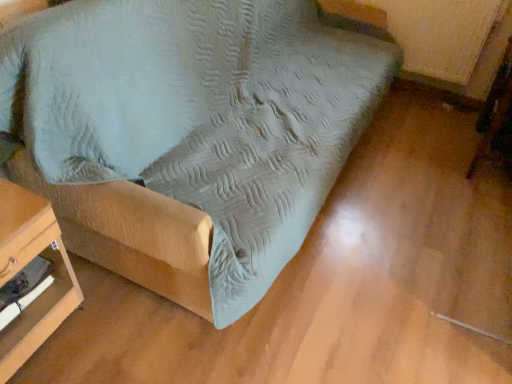
Describe the element at coordinates (496, 120) in the screenshot. I see `wooden swivel chair at lower right` at that location.

Find the location of a particular element. wooden table at lower left, which ranks as the first furniture in left-to-right order is located at coordinates (24, 266).

Locate an element on the screen. Image resolution: width=512 pixels, height=384 pixels. suede-like fabric couch at center, the 2th furniture when ordered from left to right is located at coordinates (200, 114).

Considering the points (4, 378) and (46, 45), which point is behind, point (4, 378) or point (46, 45)?

Positioned behind is point (4, 378).

Is wooden table at lower left, the 2th furniture when ordered from right to left, bigger or smaller than suede-like fabric couch at center, the 2th furniture when ordered from left to right?

In the image, wooden table at lower left, the 2th furniture when ordered from right to left, appears to be smaller than suede-like fabric couch at center, the 2th furniture when ordered from left to right.

From the image's perspective, is wooden table at lower left, which ranks as the first furniture in left-to-right order, below suede-like fabric couch at center, the 2th furniture when ordered from left to right?

Yes.

From a real-world perspective, is wooden table at lower left, which ranks as the first furniture in left-to-right order, physically located above or below suede-like fabric couch at center, the 2th furniture when ordered from left to right?

From a real-world perspective, wooden table at lower left, which ranks as the first furniture in left-to-right order, is physically below suede-like fabric couch at center, the 2th furniture when ordered from left to right.

Is wooden table at lower left, which ranks as the first furniture in left-to-right order, taller or shorter than wooden swivel chair at lower right?

wooden table at lower left, which ranks as the first furniture in left-to-right order, is shorter than wooden swivel chair at lower right.

Between wooden table at lower left, the 2th furniture when ordered from right to left, and wooden swivel chair at lower right, which one has larger size?

Bigger between the two is wooden swivel chair at lower right.

Is wooden swivel chair at lower right a part of wooden table at lower left, the 2th furniture when ordered from right to left?

No, wooden swivel chair at lower right is not a part of wooden table at lower left, the 2th furniture when ordered from right to left.

Between suede-like fabric couch at center, the 2th furniture when ordered from left to right, and wooden swivel chair at lower right, which one has more height?

Standing taller between the two is suede-like fabric couch at center, the 2th furniture when ordered from left to right.

Which object is closer to the camera, suede-like fabric couch at center, placed as the 1th furniture when sorted from right to left, or wooden swivel chair at lower right?

suede-like fabric couch at center, placed as the 1th furniture when sorted from right to left, is closer to the camera.

Looking at this image, are suede-like fabric couch at center, placed as the 1th furniture when sorted from right to left, and wooden swivel chair at lower right beside each other?

No, suede-like fabric couch at center, placed as the 1th furniture when sorted from right to left, is not beside wooden swivel chair at lower right.

Considering the sizes of objects suede-like fabric couch at center, the 2th furniture when ordered from left to right, and wooden swivel chair at lower right in the image provided, who is wider, suede-like fabric couch at center, the 2th furniture when ordered from left to right, or wooden swivel chair at lower right?

suede-like fabric couch at center, the 2th furniture when ordered from left to right.

From a real-world perspective, between suede-like fabric couch at center, placed as the 1th furniture when sorted from right to left, and wooden table at lower left, which ranks as the first furniture in left-to-right order, who is vertically higher?

In real-world perspective, suede-like fabric couch at center, placed as the 1th furniture when sorted from right to left, is above.

Based on the photo, is suede-like fabric couch at center, placed as the 1th furniture when sorted from right to left, positioned beyond the bounds of wooden table at lower left, which ranks as the first furniture in left-to-right order?

suede-like fabric couch at center, placed as the 1th furniture when sorted from right to left, is positioned outside wooden table at lower left, which ranks as the first furniture in left-to-right order.

Which is farther from the camera, (217, 7) or (41, 199)?

The point (217, 7) is behind.

Is suede-like fabric couch at center, placed as the 1th furniture when sorted from right to left, wider or thinner than wooden table at lower left, the 2th furniture when ordered from right to left?

In the image, suede-like fabric couch at center, placed as the 1th furniture when sorted from right to left, appears to be wider than wooden table at lower left, the 2th furniture when ordered from right to left.

Is wooden swivel chair at lower right with wooden table at lower left, which ranks as the first furniture in left-to-right order?

They are not placed beside each other.

Which of these two, wooden swivel chair at lower right or wooden table at lower left, the 2th furniture when ordered from right to left, is wider?

With larger width is wooden table at lower left, the 2th furniture when ordered from right to left.

Based on their sizes in the image, would you say wooden swivel chair at lower right is bigger or smaller than wooden table at lower left, which ranks as the first furniture in left-to-right order?

wooden swivel chair at lower right is bigger than wooden table at lower left, which ranks as the first furniture in left-to-right order.

Is wooden swivel chair at lower right far from suede-like fabric couch at center, the 2th furniture when ordered from left to right?

Yes.

Between wooden swivel chair at lower right and suede-like fabric couch at center, the 2th furniture when ordered from left to right, which one has less height?

With less height is wooden swivel chair at lower right.

From the image's perspective, which object appears higher, wooden swivel chair at lower right or suede-like fabric couch at center, the 2th furniture when ordered from left to right?

suede-like fabric couch at center, the 2th furniture when ordered from left to right, appears higher in the image.

Which is in front, wooden swivel chair at lower right or suede-like fabric couch at center, placed as the 1th furniture when sorted from right to left?

suede-like fabric couch at center, placed as the 1th furniture when sorted from right to left, is more forward.

Locate an element on the screen. The height and width of the screenshot is (384, 512). furniture located below the suede-like fabric couch at center, placed as the 1th furniture when sorted from right to left (from the image's perspective) is located at coordinates (24, 266).

Identify the location of swivel chair behind the wooden table at lower left, which ranks as the first furniture in left-to-right order. (496, 120).

Based on the photo, looking at the image, which one is located closer to suede-like fabric couch at center, placed as the 1th furniture when sorted from right to left, wooden table at lower left, the 2th furniture when ordered from right to left, or wooden swivel chair at lower right?

wooden table at lower left, the 2th furniture when ordered from right to left.

Looking at the image, which one is located closer to wooden table at lower left, the 2th furniture when ordered from right to left, wooden swivel chair at lower right or suede-like fabric couch at center, placed as the 1th furniture when sorted from right to left?

suede-like fabric couch at center, placed as the 1th furniture when sorted from right to left, is positioned closer to the anchor wooden table at lower left, the 2th furniture when ordered from right to left.

From the image, which object appears to be nearer to wooden swivel chair at lower right, suede-like fabric couch at center, the 2th furniture when ordered from left to right, or wooden table at lower left, the 2th furniture when ordered from right to left?

Among the two, suede-like fabric couch at center, the 2th furniture when ordered from left to right, is located nearer to wooden swivel chair at lower right.

Which object lies further to the anchor point suede-like fabric couch at center, the 2th furniture when ordered from left to right, wooden swivel chair at lower right or wooden table at lower left, which ranks as the first furniture in left-to-right order?

wooden swivel chair at lower right.

From the picture: Looking at the image, which one is located closer to wooden table at lower left, which ranks as the first furniture in left-to-right order, suede-like fabric couch at center, the 2th furniture when ordered from left to right, or wooden swivel chair at lower right?

suede-like fabric couch at center, the 2th furniture when ordered from left to right.

Which object lies nearer to the anchor point wooden swivel chair at lower right, wooden table at lower left, which ranks as the first furniture in left-to-right order, or suede-like fabric couch at center, the 2th furniture when ordered from left to right?

suede-like fabric couch at center, the 2th furniture when ordered from left to right, is closer to wooden swivel chair at lower right.

Locate an element on the screen. This screenshot has width=512, height=384. furniture between wooden table at lower left, which ranks as the first furniture in left-to-right order, and wooden swivel chair at lower right is located at coordinates (200, 114).